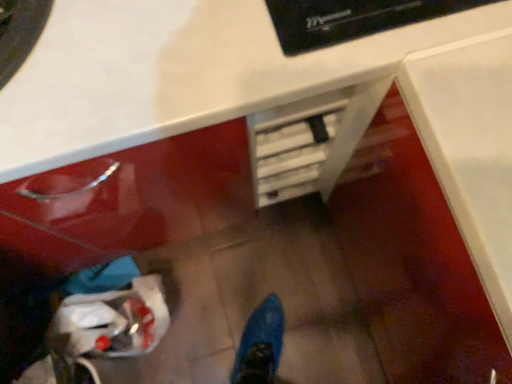
Find the location of a particular element. white glossy counter at center is located at coordinates (180, 73).

Describe the element at coordinates (180, 73) in the screenshot. The height and width of the screenshot is (384, 512). I see `white glossy counter at center` at that location.

What are the coordinates of `white glossy counter at center` in the screenshot? It's located at (180, 73).